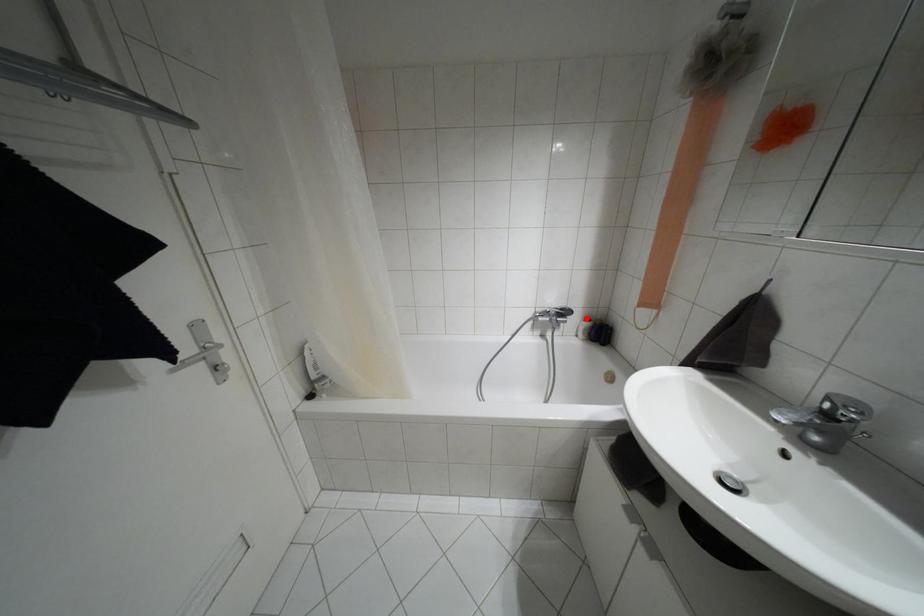
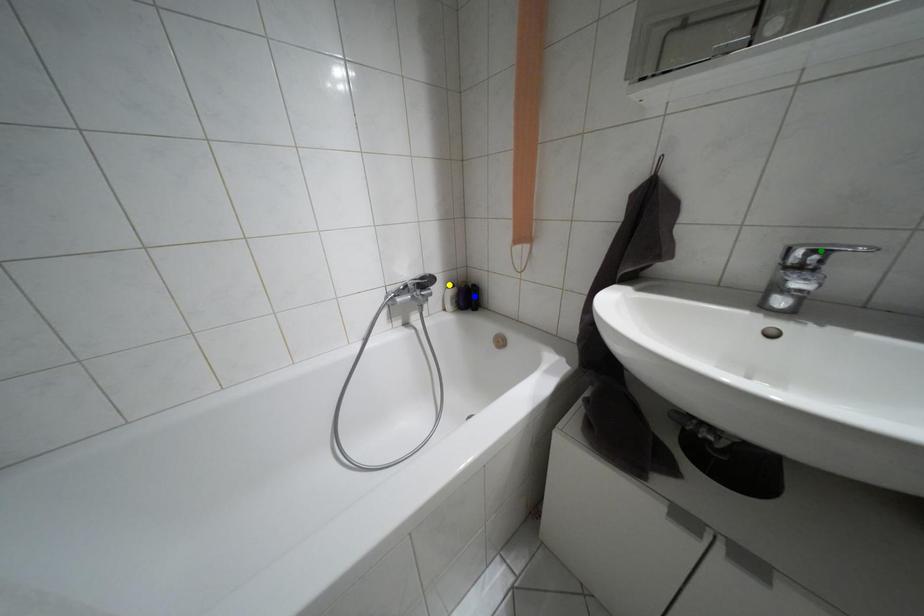
Question: I am providing you with two images of the same scene from different viewpoints. A red point is marked on the first image. You are given multiple points on the second image. Which mark in image 2 goes with the point in image 1?

Choices:
 (A) blue point
 (B) yellow point
 (C) green point

Answer: (B)